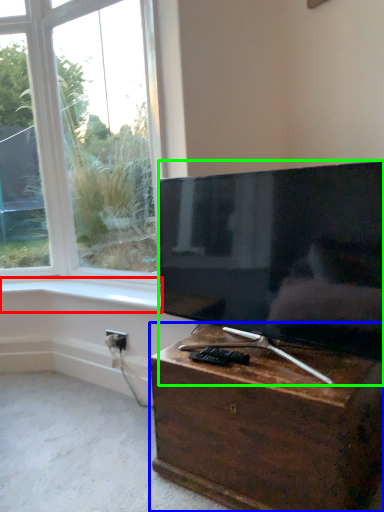
Question: Considering the real-world distances, which object is closest to window sill (highlighted by a red box)? nightstand (highlighted by a blue box) or television (highlighted by a green box).

Choices:
 (A) nightstand
 (B) television

Answer: (B)